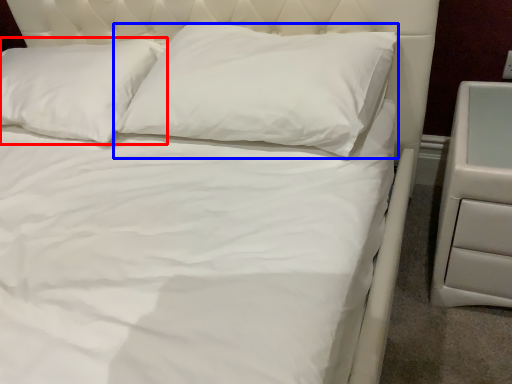
Question: Which object is closer to the camera taking this photo, pillow (highlighted by a red box) or pillow (highlighted by a blue box)?

Choices:
 (A) pillow
 (B) pillow

Answer: (B)